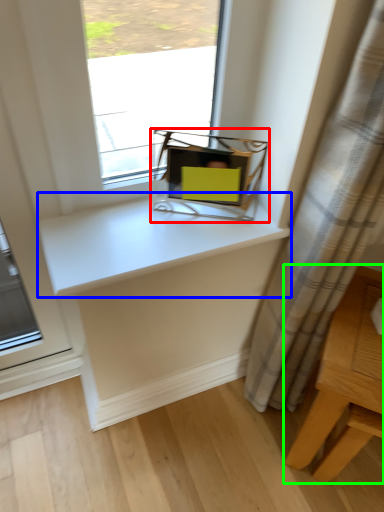
Question: Considering the real-world distances, which object is farthest from equipment (highlighted by a red box)? counter top (highlighted by a blue box) or table (highlighted by a green box)?

Choices:
 (A) counter top
 (B) table

Answer: (B)